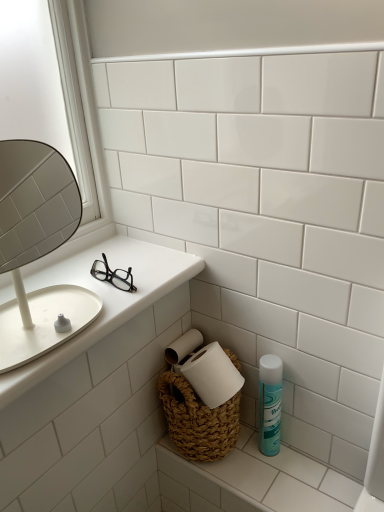
Question: Considering the relative sizes of white matte mirror at left and teal matte mouthwash at lower right in the image provided, is white matte mirror at left shorter than teal matte mouthwash at lower right?

Choices:
 (A) no
 (B) yes

Answer: (A)

Question: From the image's perspective, is white matte mirror at left under teal matte mouthwash at lower right?

Choices:
 (A) no
 (B) yes

Answer: (A)

Question: Is white matte mirror at left at the left side of teal matte mouthwash at lower right?

Choices:
 (A) yes
 (B) no

Answer: (A)

Question: Does white matte mirror at left have a greater height compared to teal matte mouthwash at lower right?

Choices:
 (A) no
 (B) yes

Answer: (B)

Question: From the image's perspective, is white matte mirror at left on top of teal matte mouthwash at lower right?

Choices:
 (A) yes
 (B) no

Answer: (A)

Question: In the image, is white glossy counter top at left, placed as the second counter top when sorted from bottom to top, positioned in front of or behind white matte mirror at left?

Choices:
 (A) behind
 (B) front

Answer: (A)

Question: In the image, is white glossy counter top at left, which is counted as the first counter top, starting from the top, on the left side or the right side of white matte mirror at left?

Choices:
 (A) right
 (B) left

Answer: (A)

Question: Is white glossy counter top at left, the 2th counter top in the right-to-left sequence, situated inside white matte mirror at left or outside?

Choices:
 (A) inside
 (B) outside

Answer: (B)

Question: From the image's perspective, is white glossy counter top at left, which is counted as the first counter top, starting from the top, above or below white matte mirror at left?

Choices:
 (A) above
 (B) below

Answer: (B)

Question: In terms of height, does white matte mirror at left look taller or shorter compared to teal matte mouthwash at lower right?

Choices:
 (A) tall
 (B) short

Answer: (A)

Question: Considering the relative positions of white matte mirror at left and teal matte mouthwash at lower right in the image provided, is white matte mirror at left to the left or to the right of teal matte mouthwash at lower right?

Choices:
 (A) right
 (B) left

Answer: (B)

Question: Considering the positions of point (21, 193) and point (266, 402), is point (21, 193) closer or farther from the camera than point (266, 402)?

Choices:
 (A) closer
 (B) farther

Answer: (B)

Question: In terms of width, does white matte mirror at left look wider or thinner when compared to teal matte mouthwash at lower right?

Choices:
 (A) thin
 (B) wide

Answer: (B)

Question: Looking at the image, does white woven basket at lower right, the 1th counter top positioned from the right, seem bigger or smaller compared to white matte mirror at left?

Choices:
 (A) small
 (B) big

Answer: (A)

Question: From the image's perspective, is white woven basket at lower right, marked as the second counter top in a left-to-right arrangement, positioned above or below white matte mirror at left?

Choices:
 (A) above
 (B) below

Answer: (B)